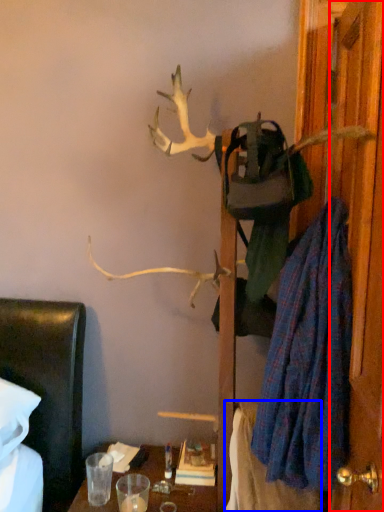
Question: Which point is closer to the camera, door (highlighted by a red box) or blanket (highlighted by a blue box)?

Choices:
 (A) door
 (B) blanket

Answer: (A)